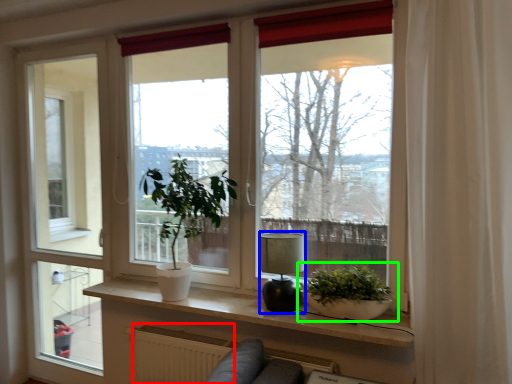
Question: Which is farther away from radiator (highlighted by a red box)? lamp (highlighted by a blue box) or houseplant (highlighted by a green box)?

Choices:
 (A) lamp
 (B) houseplant

Answer: (B)